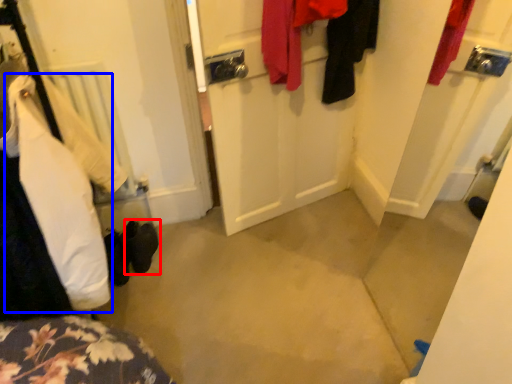
Question: Among these objects, which one is nearest to the camera, footwear (highlighted by a red box) or clothing (highlighted by a blue box)?

Choices:
 (A) footwear
 (B) clothing

Answer: (B)